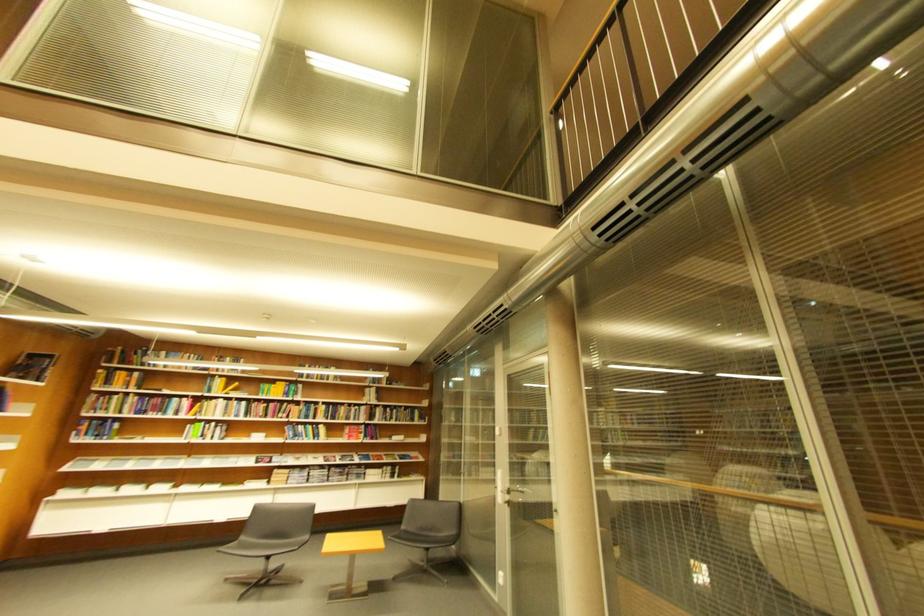
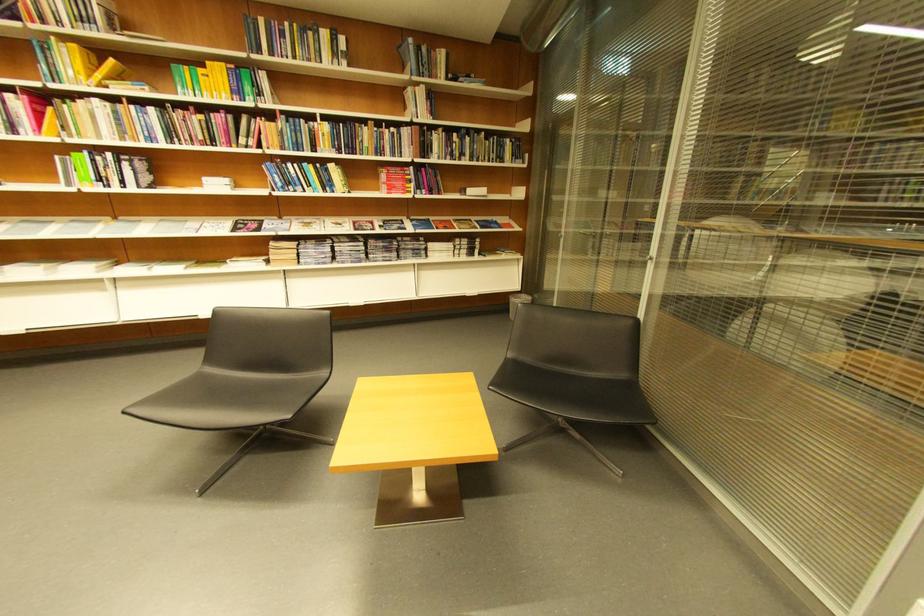
In the second image, find the point that corresponds to pixel 292 419 in the first image.

(258, 148)